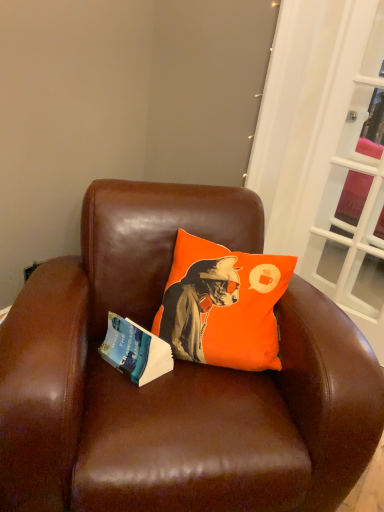
Question: Would you say white glass screen door at right is to the left or to the right of blue paper book at left in the picture?

Choices:
 (A) right
 (B) left

Answer: (A)

Question: In terms of height, does white glass screen door at right look taller or shorter compared to blue paper book at left?

Choices:
 (A) tall
 (B) short

Answer: (A)

Question: Estimate the real-world distances between objects in this image. Which object is farther from the blue paper book at left?

Choices:
 (A) orange fabric pillow at center
 (B) brown leather chair at center
 (C) white glass screen door at right

Answer: (C)

Question: Which object is positioned closest to the blue paper book at left?

Choices:
 (A) orange fabric pillow at center
 (B) white glass screen door at right
 (C) brown leather chair at center

Answer: (A)